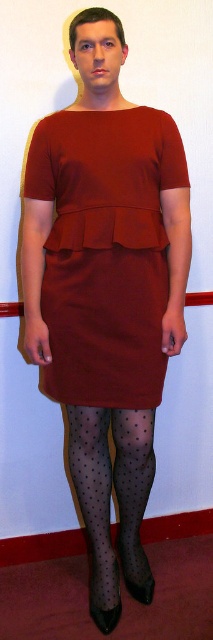
What are the coordinates of the burgundy matte dress at center in the image?

The coordinates of the burgundy matte dress at center are at point (106, 252).

You are a fashion designer observing the image. You need to determine if the transparent polka dot tights at lower center are visible above the hemline of the burgundy matte dress at center. Based on the scene description, can you confirm this?

The burgundy matte dress at center is taller than transparent polka dot tights at lower center, meaning the dress extends lower and covers part of the tights. Therefore, the transparent polka dot tights at lower center are not fully visible above the hemline of the dress.

You are a fashion designer looking at the image. You need to determine the placement of the burgundy matte dress at center and the transparent polka dot tights at lower center. Which object is located to the left of the other?

The burgundy matte dress at center is positioned on the left side of transparent polka dot tights at lower center.